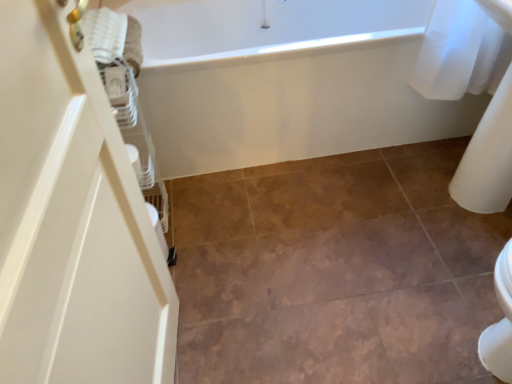
Where is `white glossy bathtub at upper center`? The height and width of the screenshot is (384, 512). white glossy bathtub at upper center is located at coordinates (285, 81).

Where is `ceramic tile below the white glossy bathtub at upper center (from the image's perspective)`? This screenshot has height=384, width=512. ceramic tile below the white glossy bathtub at upper center (from the image's perspective) is located at coordinates (335, 271).

Is the depth of brown matte tile at center less than that of white glossy bathtub at upper center?

Yes, brown matte tile at center is closer to the camera.

In the scene shown: Is brown matte tile at center looking in the opposite direction of white glossy bathtub at upper center?

No, brown matte tile at center's orientation is not away from white glossy bathtub at upper center.

Is brown matte tile at center positioned far away from white glossy bathtub at upper center?

No, brown matte tile at center is in close proximity to white glossy bathtub at upper center.

Is white textured towel at upper left aimed at white glossy bathtub at upper center?

No, white textured towel at upper left is not oriented towards white glossy bathtub at upper center.

Looking at the image, does white textured towel at upper left seem bigger or smaller compared to white glossy bathtub at upper center?

white textured towel at upper left is smaller than white glossy bathtub at upper center.

Looking at this image, from a real-world perspective, which is physically below, white textured towel at upper left or white glossy bathtub at upper center?

white glossy bathtub at upper center, from a real-world perspective.

Based on their positions, is white textured towel at upper left located to the left or right of white glossy bathtub at upper center?

Clearly, white textured towel at upper left is on the left of white glossy bathtub at upper center in the image.

From the image's perspective, is white textured towel at upper left on brown matte tile at center?

Indeed, from the image's perspective, white textured towel at upper left is shown above brown matte tile at center.

Consider the image. Which object is further away from the camera, white textured towel at upper left or brown matte tile at center?

white textured towel at upper left is further from the camera.

From a real-world perspective, who is located lower, white textured towel at upper left or brown matte tile at center?

brown matte tile at center is physically lower.

Can you tell me how much white textured towel at upper left and brown matte tile at center differ in facing direction?

The angular difference between white textured towel at upper left and brown matte tile at center is 90 degrees.

You are a GUI agent. You are given a task and a screenshot of the screen. Output one action in this format:
    pyautogui.click(x=<x>, y=<y>)
    Task: Click on the bathtub located above the brown matte tile at center (from a real-world perspective)
    This screenshot has height=384, width=512.
    Given the screenshot: What is the action you would take?
    pyautogui.click(x=285, y=81)

How distant is white glossy bathtub at upper center from brown matte tile at center?

19.66 inches.

From the image's perspective, who appears lower, white glossy bathtub at upper center or brown matte tile at center?

brown matte tile at center.

Is the depth of white glossy bathtub at upper center greater than that of brown matte tile at center?

Yes, white glossy bathtub at upper center is behind brown matte tile at center.

Find the location of a particular element. The image size is (512, 384). bathtub below the white textured towel at upper left (from a real-world perspective) is located at coordinates (285, 81).

Which object is positioned more to the right, white glossy bathtub at upper center or white textured towel at upper left?

From the viewer's perspective, white glossy bathtub at upper center appears more on the right side.

Choose the correct answer: Is white glossy bathtub at upper center inside white textured towel at upper left or outside it?

white glossy bathtub at upper center cannot be found inside white textured towel at upper left.

Is white glossy bathtub at upper center far from white textured towel at upper left?

No.

Is brown matte tile at center next to white textured towel at upper left and touching it?

They are not placed beside each other.

Which object is wider, brown matte tile at center or white textured towel at upper left?

Wider between the two is brown matte tile at center.

Locate an element on the screen. Image resolution: width=512 pixels, height=384 pixels. bathtub located above the brown matte tile at center (from the image's perspective) is located at coordinates (285, 81).

Where is `material below the white glossy bathtub at upper center (from the image's perspective)`? The height and width of the screenshot is (384, 512). material below the white glossy bathtub at upper center (from the image's perspective) is located at coordinates (104, 33).

Which object lies further to the anchor point white glossy bathtub at upper center, brown matte tile at center or white textured towel at upper left?

white textured towel at upper left is positioned further to the anchor white glossy bathtub at upper center.

When comparing their distances from white glossy bathtub at upper center, does white textured towel at upper left or brown matte tile at center seem further?

Among the two, white textured towel at upper left is located further to white glossy bathtub at upper center.

When comparing their distances from white textured towel at upper left, does brown matte tile at center or white glossy bathtub at upper center seem further?

Based on the image, brown matte tile at center appears to be further to white textured towel at upper left.

When comparing their distances from white textured towel at upper left, does white glossy bathtub at upper center or brown matte tile at center seem closer?

Based on the image, white glossy bathtub at upper center appears to be nearer to white textured towel at upper left.

Considering their positions, is white textured towel at upper left positioned closer to brown matte tile at center than white glossy bathtub at upper center?

white glossy bathtub at upper center.

Looking at the image, which one is located closer to brown matte tile at center, white glossy bathtub at upper center or white textured towel at upper left?

Among the two, white glossy bathtub at upper center is located nearer to brown matte tile at center.

The width and height of the screenshot is (512, 384). I want to click on bathtub located between white textured towel at upper left and brown matte tile at center in the left-right direction, so click(x=285, y=81).